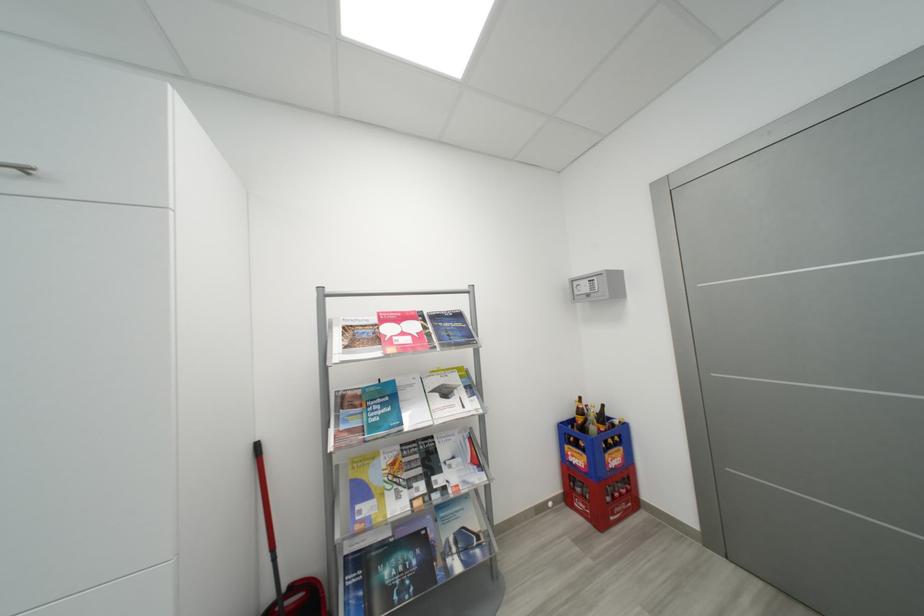
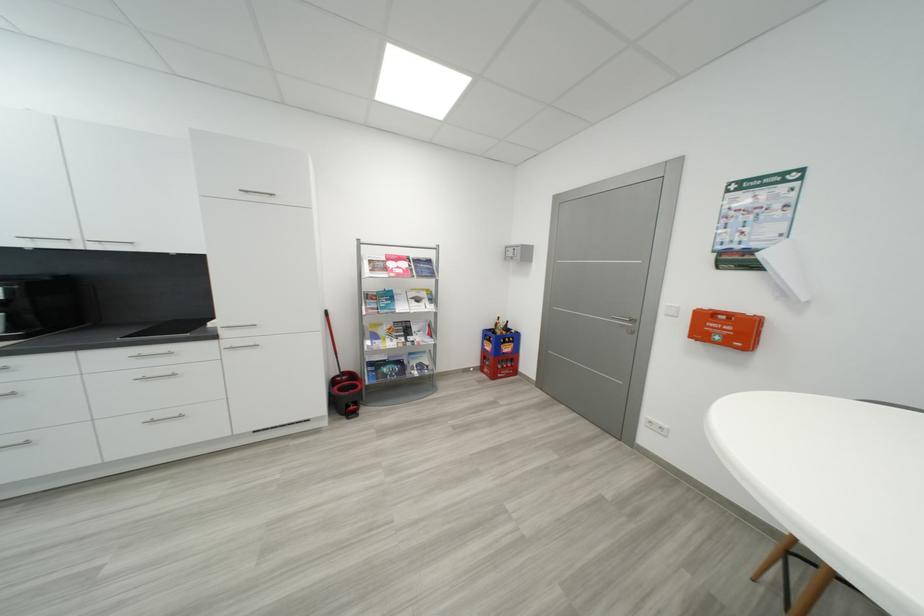
Find the pixel in the second image that matches the point at 451,454 in the first image.

(421, 330)